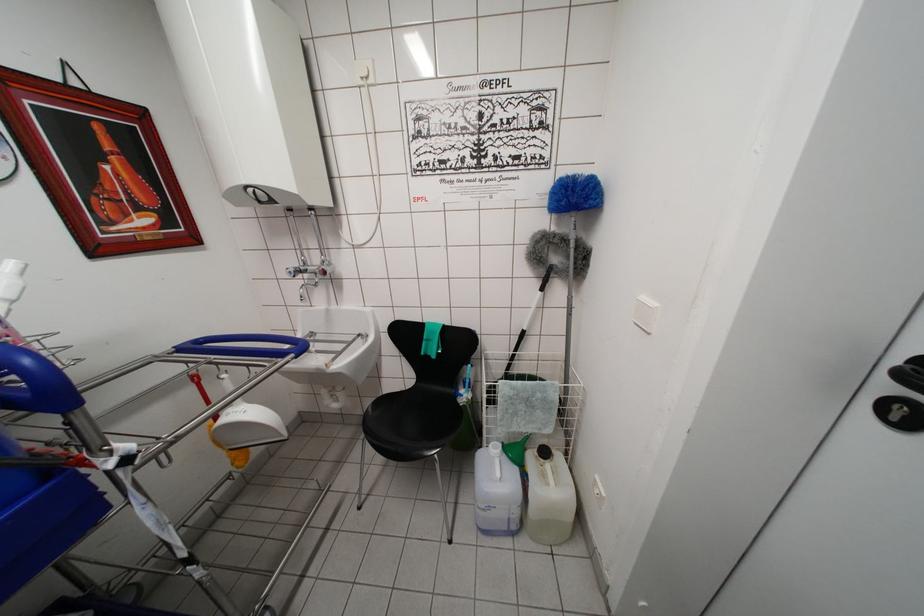
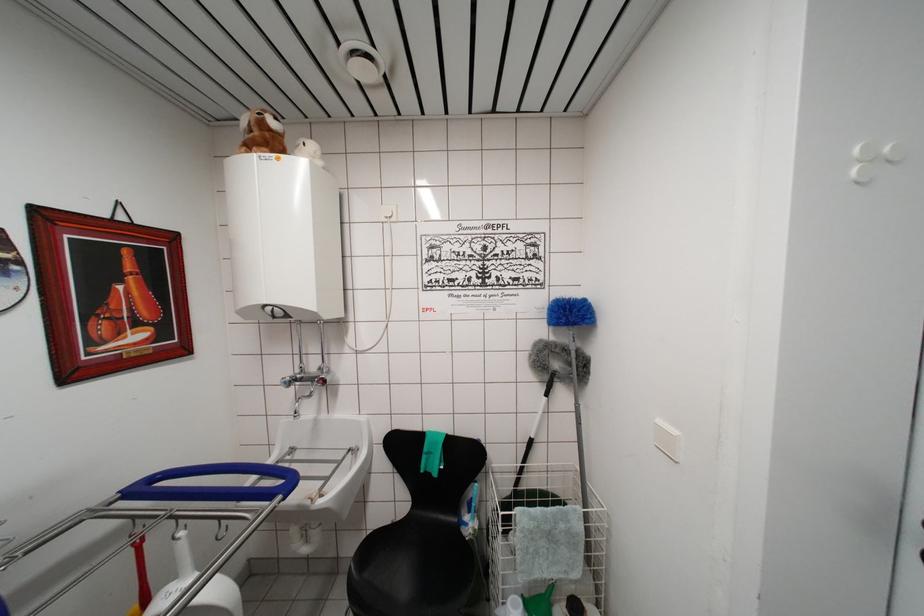
Question: The first image is from the beginning of the video and the second image is from the end. How did the camera likely rotate when shooting the video?

Choices:
 (A) Left
 (B) Right
 (C) Up
 (D) Down

Answer: (C)